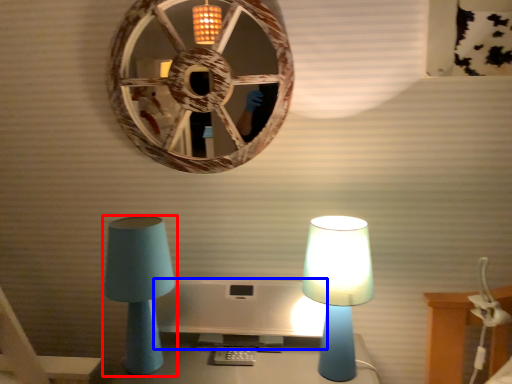
Question: Which point is closer to the camera, lamp (highlighted by a red box) or computer monitor (highlighted by a blue box)?

Choices:
 (A) lamp
 (B) computer monitor

Answer: (A)